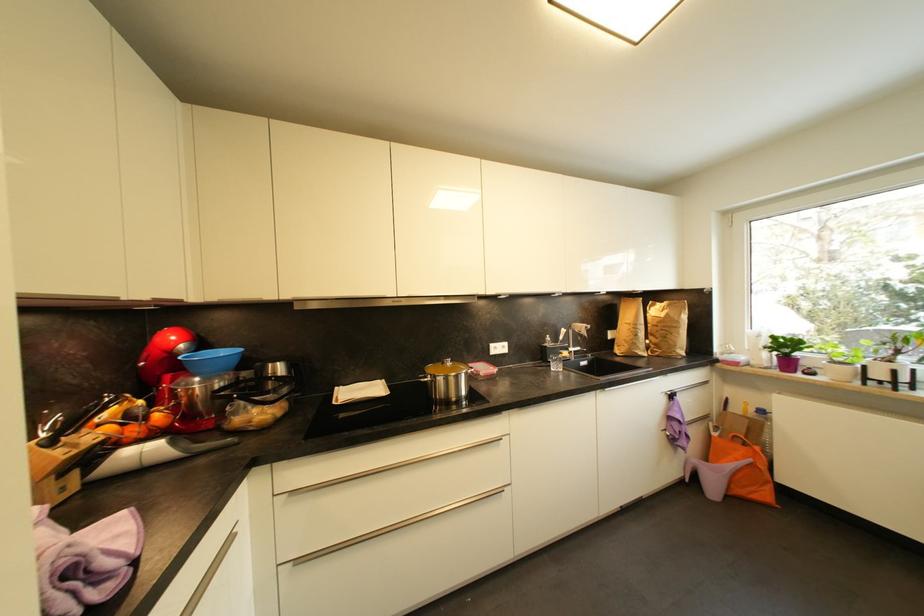
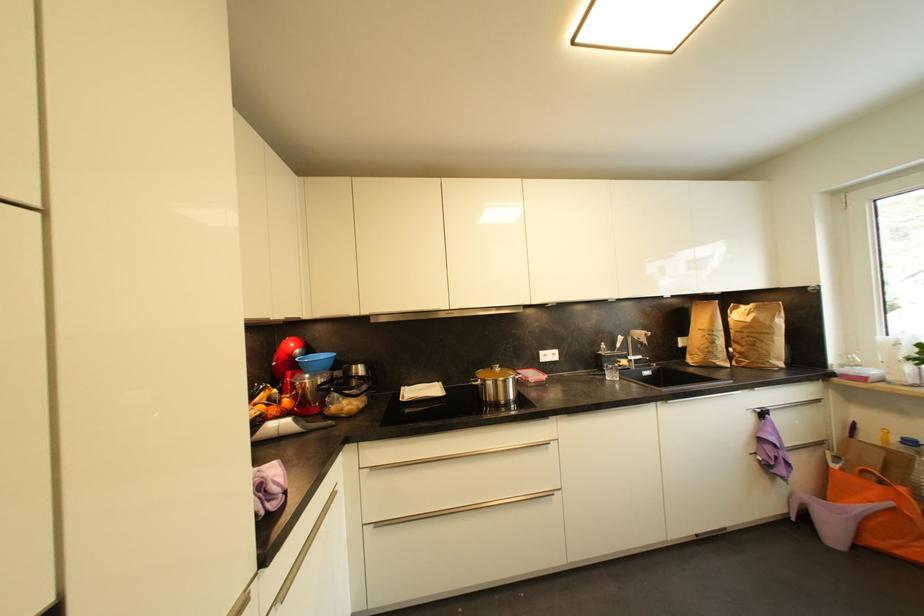
Locate, in the second image, the point that corresponds to pixel 640 337 in the first image.

(718, 345)